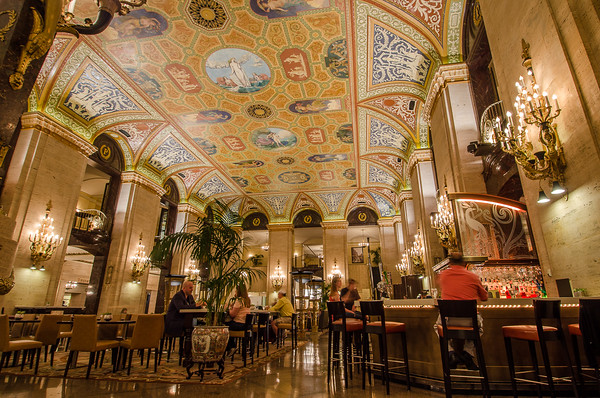
This screenshot has height=398, width=600. Find the location of `chandelier`. chandelier is located at coordinates (45, 239), (141, 259), (186, 271), (278, 275), (335, 272), (404, 262), (418, 258), (443, 229), (500, 139), (536, 112).